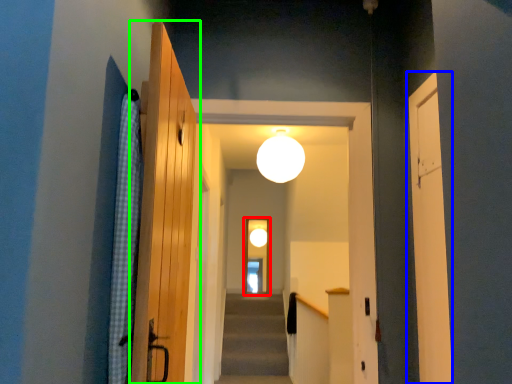
Question: Which object is the closest to the screen door (highlighted by a red box)? Choose among these: door (highlighted by a blue box) or door (highlighted by a green box).

Choices:
 (A) door
 (B) door

Answer: (A)